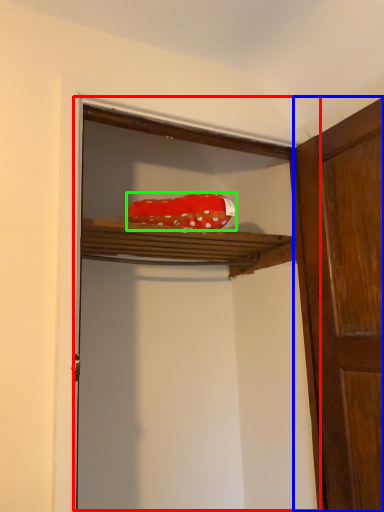
Question: Which is farther away from cabinetry (highlighted by a red box)? door (highlighted by a blue box) or material (highlighted by a green box)?

Choices:
 (A) door
 (B) material

Answer: (B)